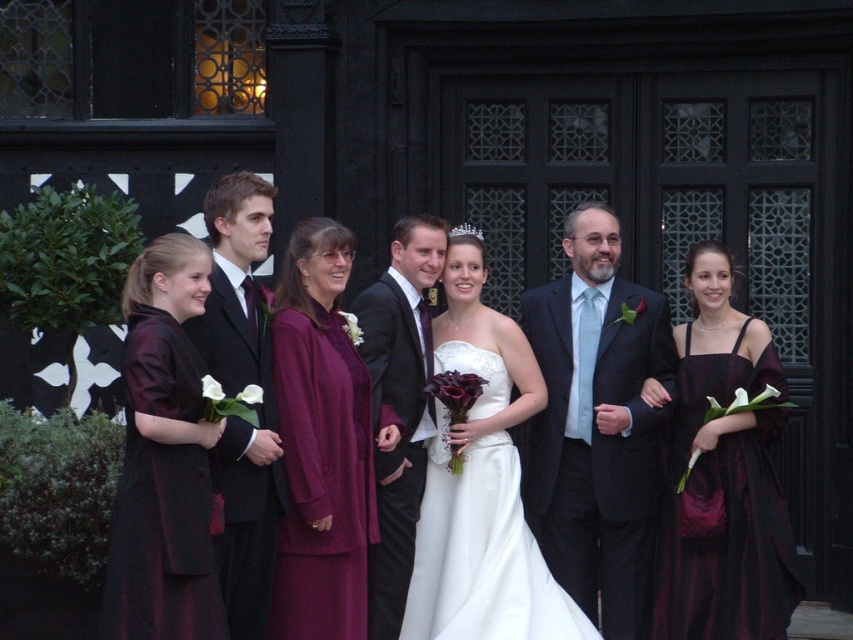
You are a photographer standing in front of the black timber framed building. You need to adjust the lighting so that both the burgundy satin dress at center and the matte black suit at center are well lit. Which object should you focus on first to ensure proper exposure?

The burgundy satin dress at center is closer to the viewer than the matte black suit at center, so you should focus on the burgundy satin dress at center first to ensure proper exposure.

You are a photographer trying to adjust the lighting for the wedding photo. You notice the burgundy satin dress at center and the matte black suit at center. Which of these two items might require more careful lighting adjustments to ensure proper exposure?

The burgundy satin dress at center is larger in size than the matte black suit at center, so it might require more careful lighting adjustments to ensure proper exposure.

Consider the image. You are a photographer trying to adjust the lighting for the wedding photo. The main light should be placed directly behind the matte black suit at center to highlight the bride. Where should you position the light in terms of coordinates?

The main light should be positioned directly behind the matte black suit at center, which is located at coordinates approximately 0.666 on the x and 0.700 on the y axis. Therefore, the light should be placed at the same coordinates but slightly behind the subject to ensure proper illumination.